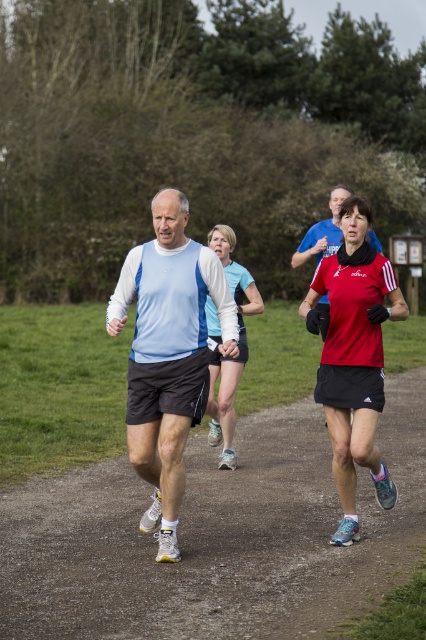
Based on the photo, who is positioned more to the right, light blue fabric shirt at center or matte red running top at center?

From the viewer's perspective, matte red running top at center appears more on the right side.

At what (x,y) coordinates should I click in order to perform the action: click on light blue fabric shirt at center. Please return your answer as a coordinate pair (x, y). This screenshot has width=426, height=640. Looking at the image, I should click on (166, 353).

Who is more forward, (161, 236) or (344, 448)?

Point (161, 236)

The image size is (426, 640). I want to click on light blue fabric shirt at center, so click(x=166, y=353).

Between brown dirt path at center and matte blue top at center, which one is positioned higher?

matte blue top at center is above.

Which is behind, point (399, 410) or point (226, 440)?

The point (399, 410) is more distant.

Find the location of a particular element. The image size is (426, 640). brown dirt path at center is located at coordinates (216, 538).

Who is more distant from viewer, (236, 371) or (331, 220)?

Point (331, 220)

Is matte blue top at center positioned in front of matte blue shirt at center?

No, it is behind matte blue shirt at center.

This screenshot has height=640, width=426. Identify the location of matte blue top at center. (238, 346).